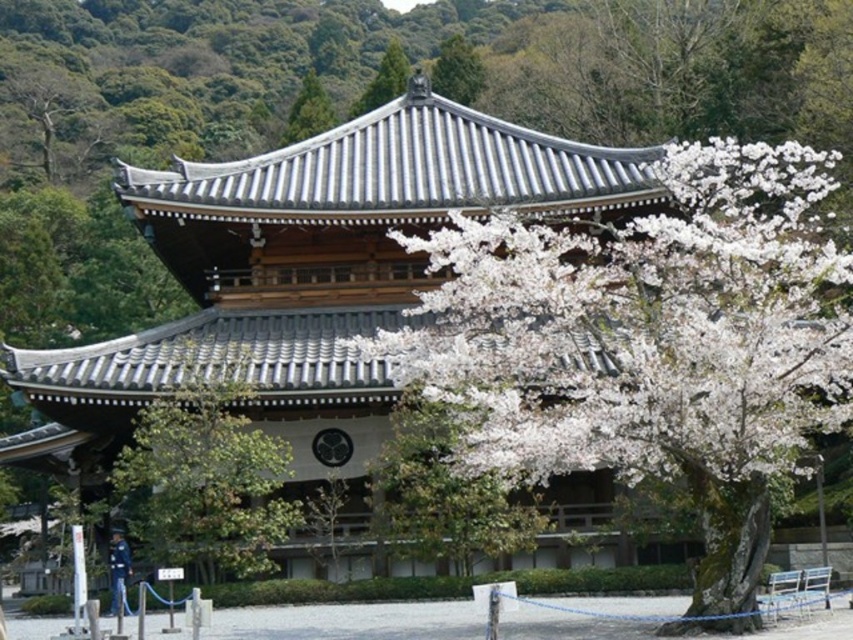
You are standing in front of a traditional Japanese temple surrounded by cherry blossoms. You notice a point marked at coordinates (466,92) in the scene. Considering the temple has a steeply pitched roof with dark gray tiles and a large circular window on the upper level, can you estimate how far this point is from your current position?

The point at coordinates (466,92) is 63.05 meters away from your current position.